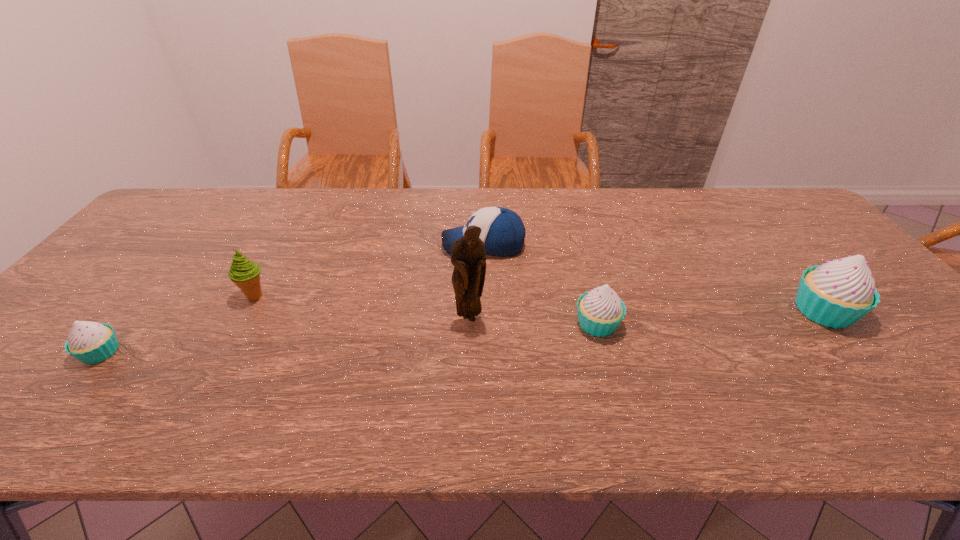
Where is `object that is at the near left corner`? object that is at the near left corner is located at coordinates (90, 342).

This screenshot has height=540, width=960. In order to click on vacant space at the far edge of the desktop in this screenshot , I will do `click(480, 200)`.

Locate an element on the screen. Image resolution: width=960 pixels, height=540 pixels. vacant space at the near edge of the desktop is located at coordinates (183, 384).

In the image, there is a desktop. What are the coordinates of `vacant space at the left edge` in the screenshot? It's located at (134, 255).

In the image, there is a desktop. At what (x,y) coordinates should I click in order to perform the action: click on blank space at the right edge. Please return your answer as a coordinate pair (x, y). Looking at the image, I should click on (900, 339).

Find the location of a particular element. This screenshot has width=960, height=540. vacant space at the near left corner is located at coordinates (37, 368).

Where is `vacant region at the far right corner`? vacant region at the far right corner is located at coordinates (788, 216).

The width and height of the screenshot is (960, 540). Identify the location of vacant region at the near right corner of the desktop. (955, 368).

The height and width of the screenshot is (540, 960). Identify the location of blank region between the second object from right to left and the baseball cap. (540, 285).

Identify the location of vacant area that lies between the second cupcake from right to left and the shortest cupcake. This screenshot has height=540, width=960. (349, 338).